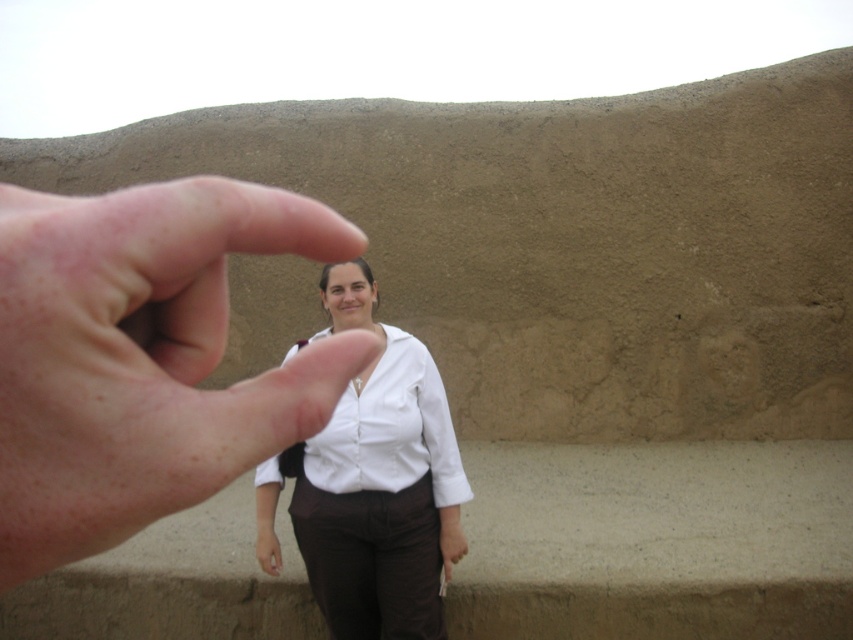
You are a photographer trying to capture the scene. The white matte shirt at center is represented by point (x=373, y=484). Where should you focus your camera to ensure the white matte shirt at center is in sharp focus?

You should focus your camera on the point (x=373, y=484) to ensure the white matte shirt at center is in sharp focus.

You are a photographer trying to capture a closeup of the textured wall in the background. You notice two shirts in the scene, a white matte shirt at center and a white smooth shirt at center. Which shirt should you avoid moving to ensure the wall remains the main focus?

The white smooth shirt at center is to the right of the white matte shirt at center, so moving the white smooth shirt at center would disrupt the composition as it is closer to the wall. However, since both shirts are at center, moving either might affect the focus. Wait, the description says the white matte shirt is to the left of the white smooth shirt. Therefore, to keep the wall as the main focus, you should avoid moving the white smooth shirt at center because it is positioned to the right, closer to